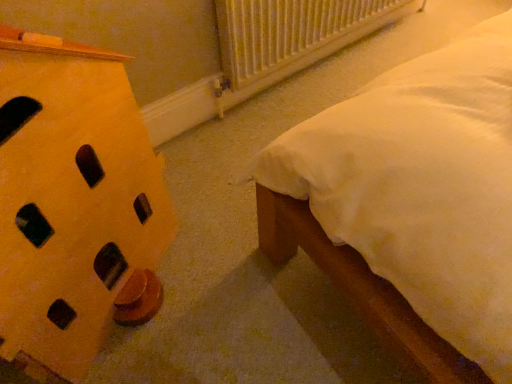
Question: From the image's perspective, would you say white plastic radiator at upper center is shown under yellow matte nightstand at left?

Choices:
 (A) no
 (B) yes

Answer: (A)

Question: Considering the relative sizes of white plastic radiator at upper center and yellow matte nightstand at left in the image provided, is white plastic radiator at upper center thinner than yellow matte nightstand at left?

Choices:
 (A) yes
 (B) no

Answer: (A)

Question: Considering the relative positions of white plastic radiator at upper center and yellow matte nightstand at left in the image provided, is white plastic radiator at upper center behind yellow matte nightstand at left?

Choices:
 (A) yes
 (B) no

Answer: (A)

Question: Is white plastic radiator at upper center not close to yellow matte nightstand at left?

Choices:
 (A) yes
 (B) no

Answer: (B)

Question: Does white plastic radiator at upper center have a smaller size compared to yellow matte nightstand at left?

Choices:
 (A) no
 (B) yes

Answer: (B)

Question: In the image, is white plastic radiator at upper center positioned in front of or behind yellow matte nightstand at left?

Choices:
 (A) front
 (B) behind

Answer: (B)

Question: In terms of size, does white plastic radiator at upper center appear bigger or smaller than yellow matte nightstand at left?

Choices:
 (A) big
 (B) small

Answer: (B)

Question: Is white plastic radiator at upper center wider or thinner than yellow matte nightstand at left?

Choices:
 (A) thin
 (B) wide

Answer: (A)

Question: From the image's perspective, relative to yellow matte nightstand at left, is white plastic radiator at upper center above or below?

Choices:
 (A) below
 (B) above

Answer: (B)

Question: Considering the relative positions of yellow matte nightstand at left and white plastic radiator at upper center in the image provided, is yellow matte nightstand at left to the left or to the right of white plastic radiator at upper center?

Choices:
 (A) left
 (B) right

Answer: (B)

Question: In the image, is yellow matte nightstand at left positioned in front of or behind white plastic radiator at upper center?

Choices:
 (A) behind
 (B) front

Answer: (B)

Question: In terms of height, does yellow matte nightstand at left look taller or shorter compared to white plastic radiator at upper center?

Choices:
 (A) short
 (B) tall

Answer: (A)

Question: From the image's perspective, is yellow matte nightstand at left located above or below white plastic radiator at upper center?

Choices:
 (A) below
 (B) above

Answer: (A)

Question: Visually, is yellow matte wooden block at left positioned to the left or to the right of yellow matte nightstand at left?

Choices:
 (A) left
 (B) right

Answer: (A)

Question: From the image's perspective, is yellow matte wooden block at left positioned above or below yellow matte nightstand at left?

Choices:
 (A) below
 (B) above

Answer: (A)